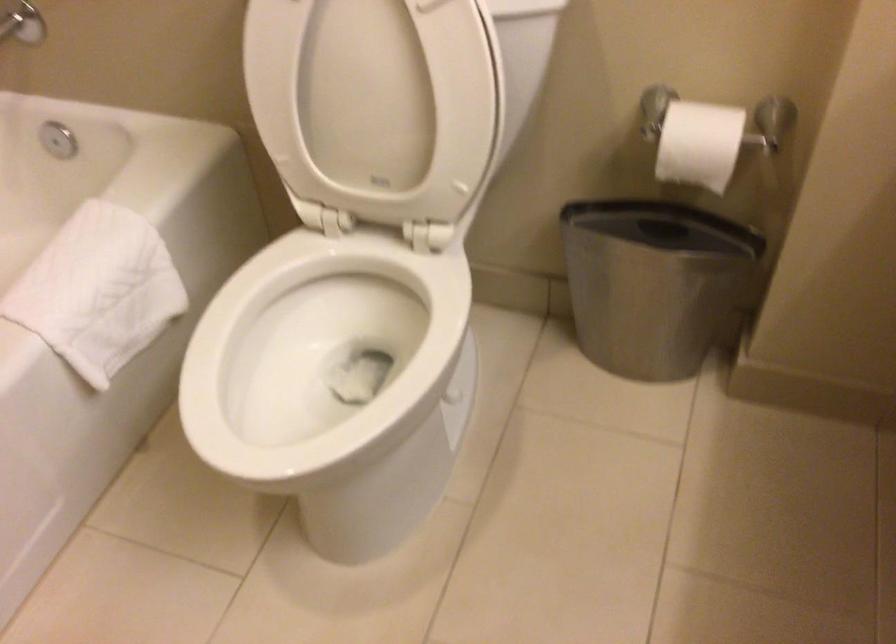
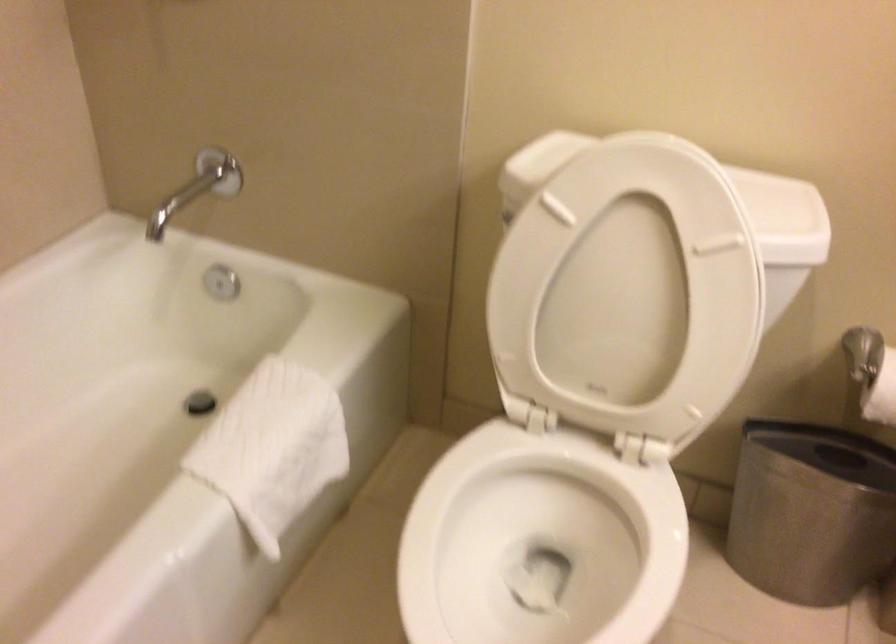
In the second image, find the point that corresponds to point 665,151 in the first image.

(881, 393)